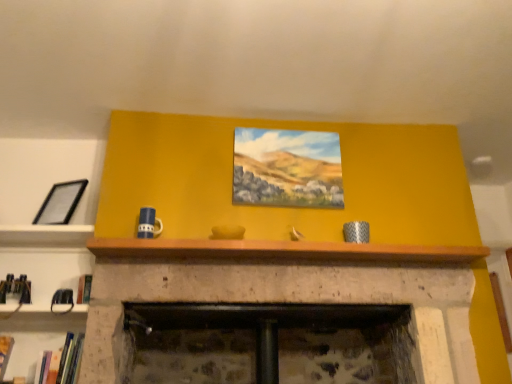
Question: Relative to hardcover book at lower left, which is counted as the second book, starting from the left, is hardcover book at lower left, which appears as the second book when viewed from the right, in front or behind?

Choices:
 (A) front
 (B) behind

Answer: (B)

Question: Based on their sizes in the image, would you say hardcover book at lower left, which appears as the second book when viewed from the right, is bigger or smaller than hardcover book at lower left, which is counted as the second book, starting from the left?

Choices:
 (A) big
 (B) small

Answer: (B)

Question: Which object is positioned closest to the hardcover book at lower left, which appears as the second book when viewed from the right?

Choices:
 (A) wooden at upper center
 (B) hardcover book at lower left, placed as the 1th book when sorted from right to left
 (C) oil painting at center, placed as the 2th picture frame when sorted from left to right
 (D) black matte picture frame at left, the 1th picture frame when ordered from left to right

Answer: (B)

Question: Which object is positioned closest to the hardcover book at lower left, the 1th book viewed from the left?

Choices:
 (A) oil painting at center, which is counted as the first picture frame, starting from the right
 (B) wooden at upper center
 (C) black matte picture frame at left, the 1th picture frame when ordered from left to right
 (D) hardcover book at lower left, which is counted as the second book, starting from the left

Answer: (D)